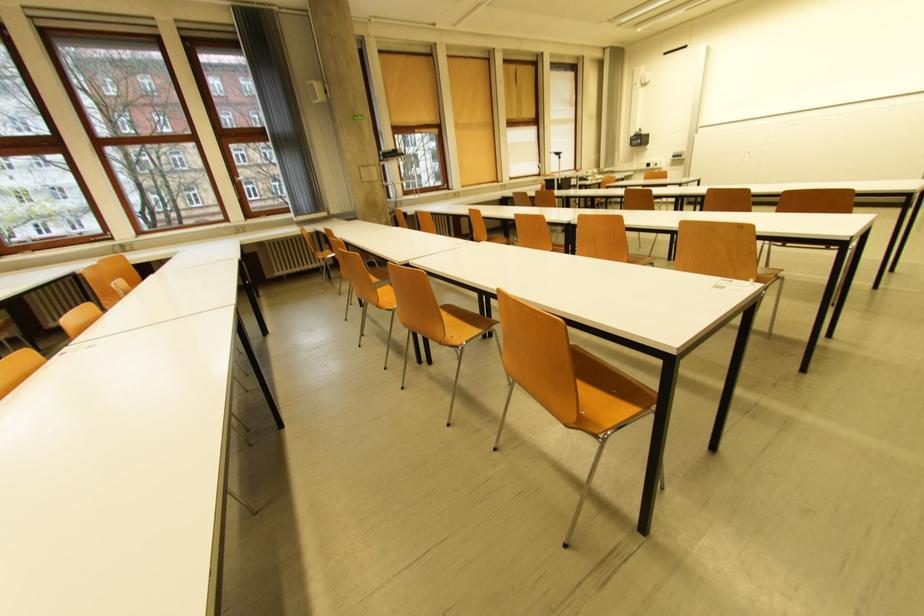
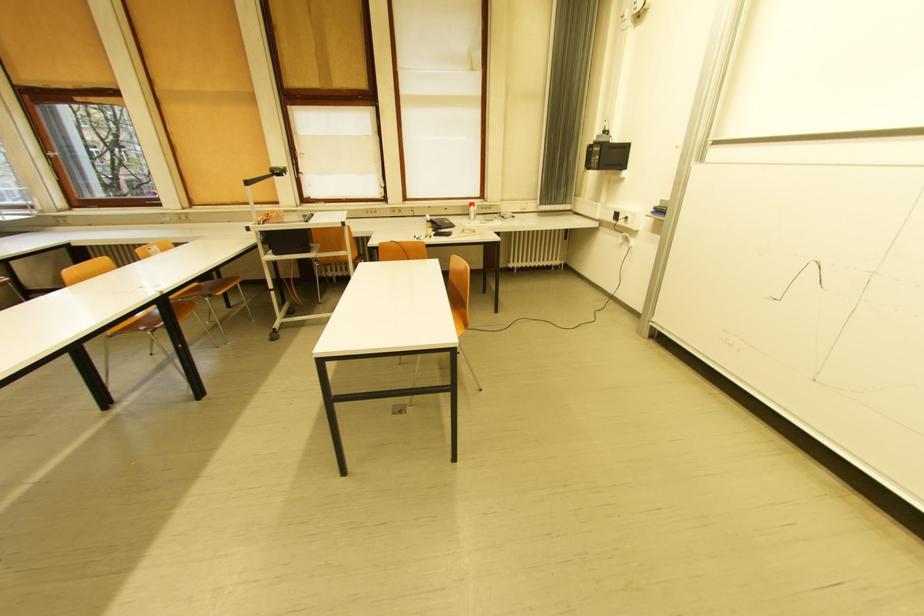
Locate, in the second image, the point that corresponds to [637,147] in the first image.

(592, 168)